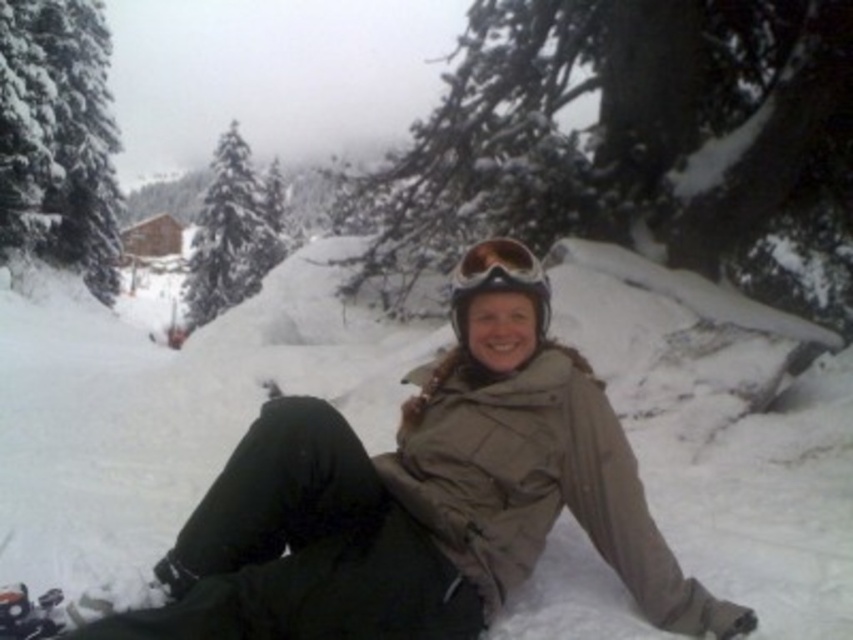
Question: Considering the real-world distances, which object is farthest from the matte black goggles at center?

Choices:
 (A) green matte pine at upper left
 (B) white fluffy snow at center

Answer: (A)

Question: Which point appears closest to the camera in this image?

Choices:
 (A) (518, 272)
 (B) (78, 550)
 (C) (206, 307)

Answer: (A)

Question: Considering the real-world distances, which object is closest to the matte black goggles at center?

Choices:
 (A) green matte pine at upper left
 (B) white fluffy snow at center

Answer: (B)

Question: Is white fluffy snow at center wider than matte black goggles at center?

Choices:
 (A) yes
 (B) no

Answer: (A)

Question: Does green matte pine at upper left have a smaller size compared to matte black goggles at center?

Choices:
 (A) no
 (B) yes

Answer: (A)

Question: Can you confirm if white fluffy snow at center is wider than matte black goggles at center?

Choices:
 (A) yes
 (B) no

Answer: (A)